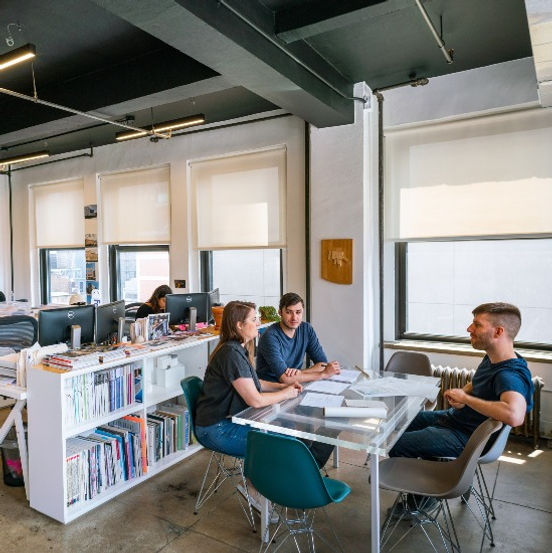
Where is `radiator`? The width and height of the screenshot is (552, 553). radiator is located at coordinates (447, 377).